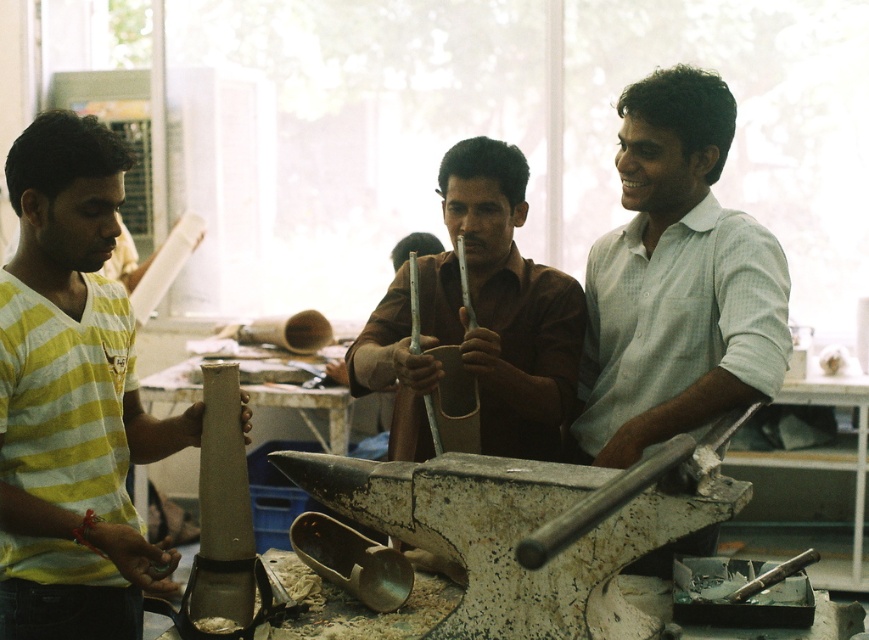
Between yellow striped shirt at left and brown matte cup at center, which one has less height?

brown matte cup at center is shorter.

Which is behind, point (52, 417) or point (506, 314)?

The point (506, 314) is behind.

Is point (21, 333) positioned behind point (475, 138)?

No.

Where is `yellow striped shirt at left`? The width and height of the screenshot is (869, 640). yellow striped shirt at left is located at coordinates (71, 397).

The width and height of the screenshot is (869, 640). I want to click on yellow striped shirt at left, so click(x=71, y=397).

Does yellow striped shirt at left appear on the left side of white checkered shirt at center?

Indeed, yellow striped shirt at left is positioned on the left side of white checkered shirt at center.

Is point (45, 273) closer to viewer compared to point (624, 198)?

Yes, point (45, 273) is closer to viewer.

Image resolution: width=869 pixels, height=640 pixels. Identify the location of yellow striped shirt at left. (71, 397).

Is point (730, 397) positioned in front of point (366, 385)?

Yes, it is in front of point (366, 385).

How much distance is there between white checkered shirt at center and brown matte cup at center?

white checkered shirt at center is 10.22 inches from brown matte cup at center.

Does point (649, 164) come closer to viewer compared to point (390, 337)?

Yes, it is in front of point (390, 337).

The width and height of the screenshot is (869, 640). In order to click on white checkered shirt at center in this screenshot , I will do `click(675, 282)`.